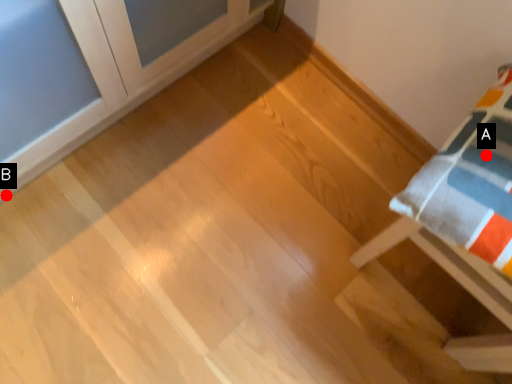
Question: Two points are circled on the image, labeled by A and B beside each circle. Which point is farther from the camera taking this photo?

Choices:
 (A) A is further
 (B) B is further

Answer: (B)